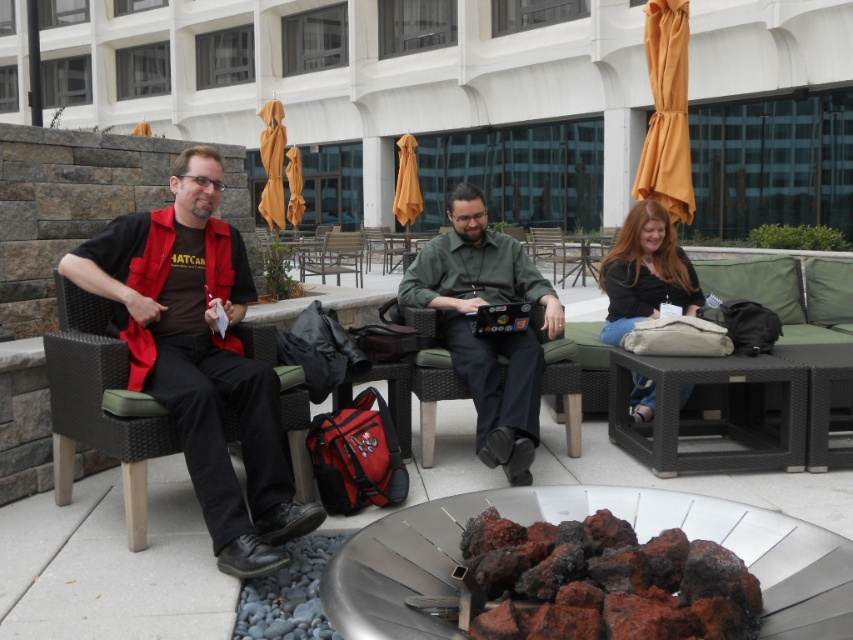
You are observing a group of people seated around a fire pit. You notice two individuals wearing matte black clothing. The person wearing the matte black vest at left and the person wearing the matte black shirt at center. Which of these two individuals is sitting closer to the fire pit?

The matte black vest at left is taller than the matte black shirt at center, so the person wearing the matte black vest at left is sitting closer to the fire pit.